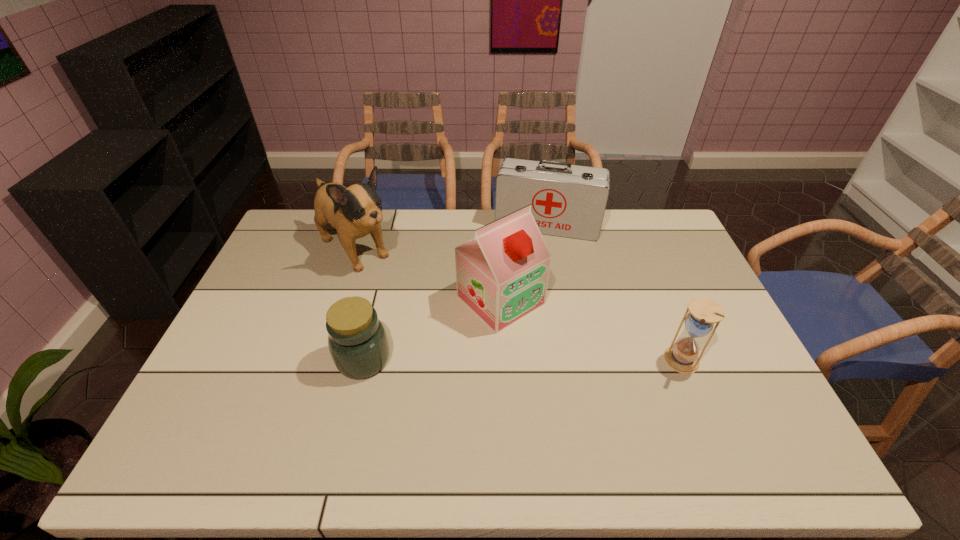
The height and width of the screenshot is (540, 960). What are the coordinates of `jar` in the screenshot? It's located at (358, 343).

Locate an element on the screen. the rightmost object is located at coordinates (682, 357).

Find the location of a particular element. puppy is located at coordinates (356, 211).

In order to click on the first-aid kit in this screenshot , I will do `click(566, 200)`.

Identify the location of soya milk. (502, 274).

Find the location of `vacant region located 0.190m on the right of the jar`. vacant region located 0.190m on the right of the jar is located at coordinates (461, 359).

Where is `free space located on the back of the rightmost object`? free space located on the back of the rightmost object is located at coordinates (644, 267).

This screenshot has width=960, height=540. I want to click on vacant space located 0.240m at the face of the puppy, so click(x=422, y=309).

Where is `vacant space located 0.170m at the face of the puppy`? vacant space located 0.170m at the face of the puppy is located at coordinates (408, 297).

Where is `free space located 0.350m at the face of the puppy`? The height and width of the screenshot is (540, 960). free space located 0.350m at the face of the puppy is located at coordinates (445, 329).